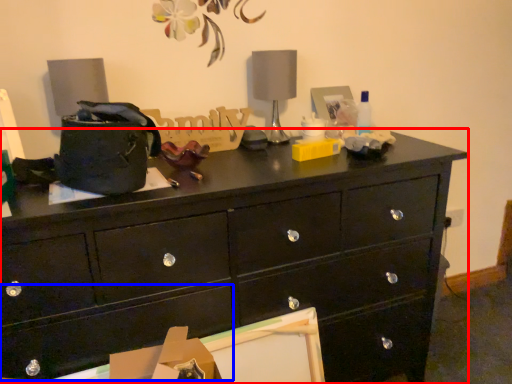
Question: Among these objects, which one is farthest to the camera, chest of drawers (highlighted by a red box) or drawer (highlighted by a blue box)?

Choices:
 (A) chest of drawers
 (B) drawer

Answer: (A)